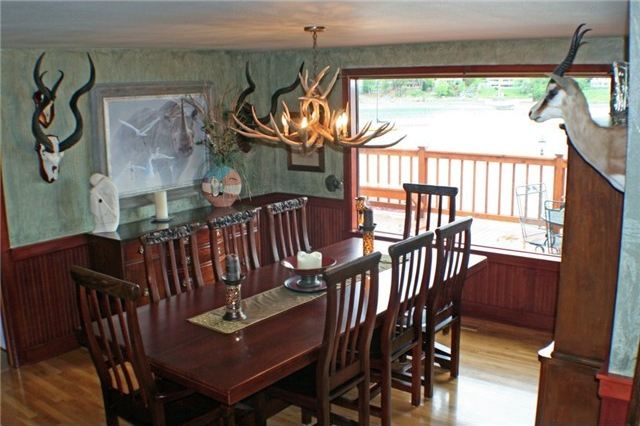
Identify the location of table mat. The height and width of the screenshot is (426, 640). (272, 305).